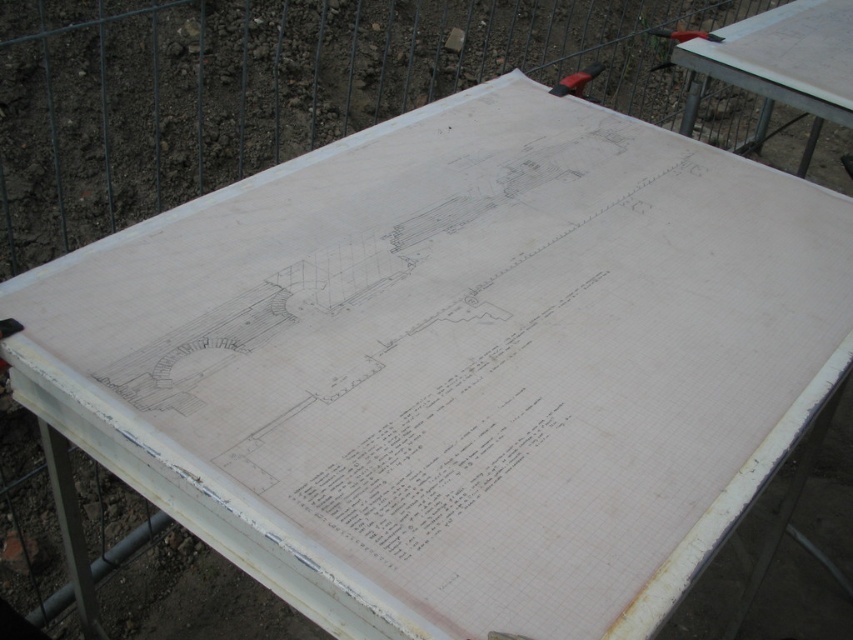
You are an architect reviewing the blueprint on the table. You notice two points marked on the blueprint at coordinates point (821, 51) and point (584, 81). Which point appears closer to the edge of the table?

Point (821, 51) is further to the viewer than point (584, 81), so it is closer to the edge of the table.